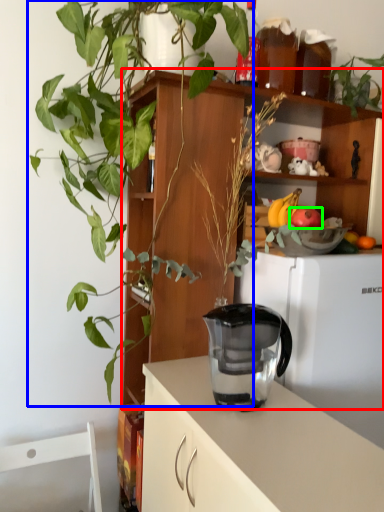
Question: Which object is positioned farthest from shelf (highlighted by a red box)? Select from houseplant (highlighted by a blue box) and apple (highlighted by a green box).

Choices:
 (A) houseplant
 (B) apple

Answer: (B)